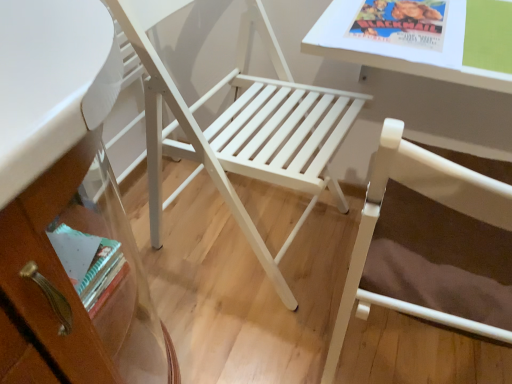
This screenshot has height=384, width=512. Find the location of `vacant space underneath white wood chair at center, which is the second chair from right to left (from a real-world perspective)`. vacant space underneath white wood chair at center, which is the second chair from right to left (from a real-world perspective) is located at coordinates (258, 230).